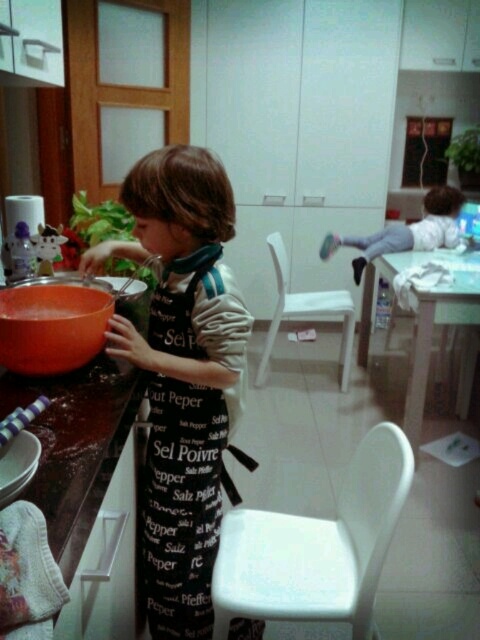
Question: Among these objects, which one is farthest from the camera?

Choices:
 (A) matte black apron at left
 (B) matte orange bowl at left

Answer: (A)

Question: Observing the image, what is the correct spatial positioning of matte black apron at left in reference to light gray fabric pants at center?

Choices:
 (A) below
 (B) above

Answer: (A)

Question: Does matte black apron at left come behind matte orange bowl at left?

Choices:
 (A) no
 (B) yes

Answer: (B)

Question: Is matte black apron at left bigger than light gray fabric pants at center?

Choices:
 (A) no
 (B) yes

Answer: (B)

Question: Which point is closer to the camera taking this photo?

Choices:
 (A) (389, 243)
 (B) (36, 284)

Answer: (B)

Question: Which of the following is the closest to the observer?

Choices:
 (A) black printed apron at center
 (B) matte orange bowl at left

Answer: (B)